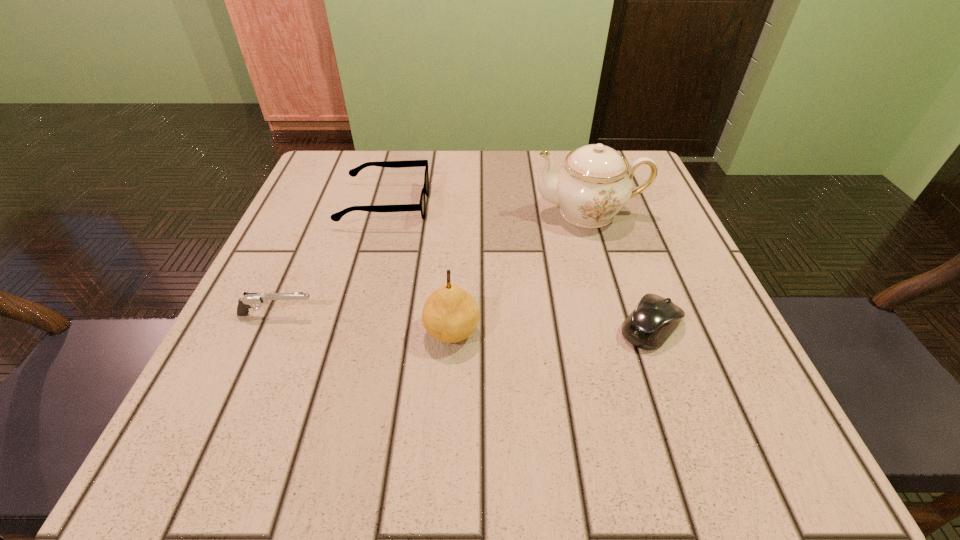
Locate an element on the screen. Image resolution: width=960 pixels, height=540 pixels. vacant space situated on the arms of the spectacles is located at coordinates tap(570, 205).

Identify the location of free spot located on the front-facing side of the pistol. The height and width of the screenshot is (540, 960). (353, 315).

Where is `vacant space located 0.260m on the left of the mouse`? vacant space located 0.260m on the left of the mouse is located at coordinates (451, 326).

Identify the location of chinaware that is at the far edge. The image size is (960, 540). (595, 182).

Find the location of `spectacles present at the far edge`. spectacles present at the far edge is located at coordinates (336, 217).

Find the location of a particular element. spectacles that is at the left edge is located at coordinates (336, 217).

Where is `pistol that is at the left edge`? This screenshot has height=540, width=960. pistol that is at the left edge is located at coordinates (249, 299).

Locate an element on the screen. The height and width of the screenshot is (540, 960). chinaware at the right edge is located at coordinates (595, 182).

Where is `mouse at the right edge`? The image size is (960, 540). mouse at the right edge is located at coordinates (654, 319).

Identify the location of object present at the far left corner. (336, 217).